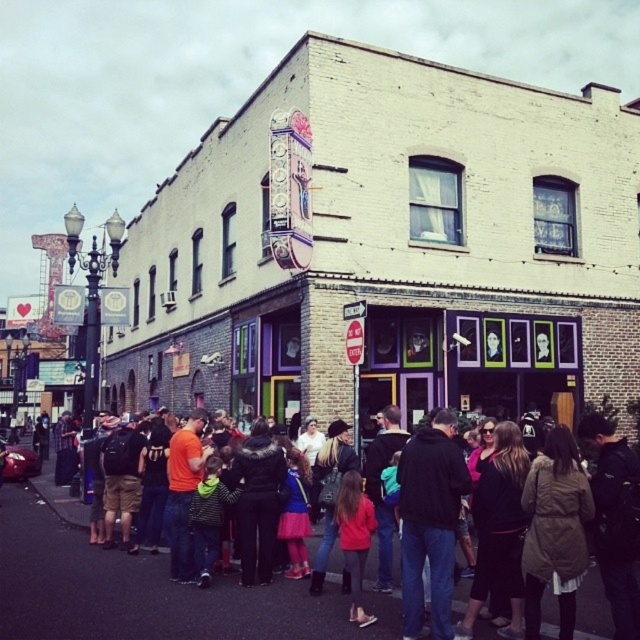
Question: Which point is farther from the camera taking this photo?

Choices:
 (A) (380, 618)
 (B) (464, 464)

Answer: (B)

Question: Among these objects, which one is farthest from the camera?

Choices:
 (A) dark brown leather jacket at center
 (B) dark blue jeans at center

Answer: (B)

Question: Which point is farther from the camera taking this photo?

Choices:
 (A) (48, 499)
 (B) (442, 486)

Answer: (A)

Question: Can you confirm if dark brown leather jacket at center is bigger than dark blue jeans at center?

Choices:
 (A) yes
 (B) no

Answer: (A)

Question: Where is dark brown leather jacket at center located in relation to dark blue jeans at center in the image?

Choices:
 (A) below
 (B) above

Answer: (A)

Question: Does dark brown leather jacket at center appear over dark blue jeans at center?

Choices:
 (A) no
 (B) yes

Answer: (A)